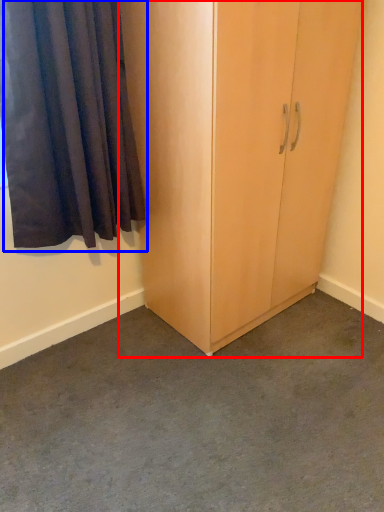
Question: Which object is closer to the camera taking this photo, cupboard (highlighted by a red box) or curtain (highlighted by a blue box)?

Choices:
 (A) cupboard
 (B) curtain

Answer: (B)